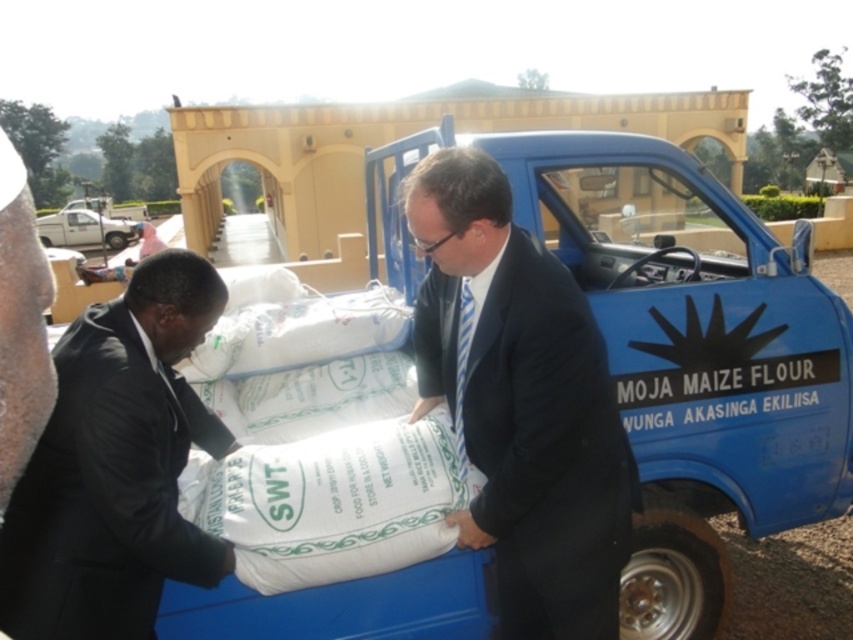
Does point (488, 449) come behind point (4, 189)?

Yes.

Is dark blue suit at center positioned before dark brown leather jacket at left?

No, it is behind dark brown leather jacket at left.

Is point (550, 256) closer to camera compared to point (13, 333)?

No, it is not.

Image resolution: width=853 pixels, height=640 pixels. In order to click on dark blue suit at center in this screenshot , I will do `click(520, 403)`.

Which is more to the right, dark blue suit at center or black matte suit at left?

dark blue suit at center is more to the right.

Which is more to the left, dark blue suit at center or black matte suit at left?

From the viewer's perspective, black matte suit at left appears more on the left side.

Between point (556, 416) and point (102, 579), which one is positioned behind?

Point (556, 416)

Where is `dark blue suit at center`? dark blue suit at center is located at coordinates (520, 403).

Can you confirm if white matte sack at center is wider than dark brown leather jacket at left?

Yes, white matte sack at center is wider than dark brown leather jacket at left.

Does white matte sack at center appear over dark brown leather jacket at left?

Indeed, white matte sack at center is positioned over dark brown leather jacket at left.

Find the location of a particular element. The image size is (853, 640). white matte sack at center is located at coordinates (694, 356).

What are the coordinates of `white matte sack at center` in the screenshot? It's located at (694, 356).